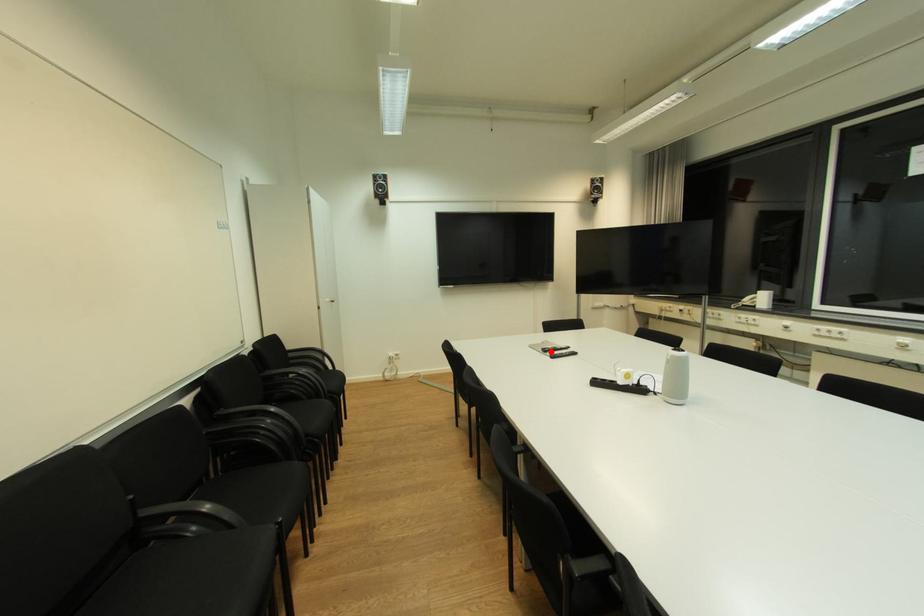
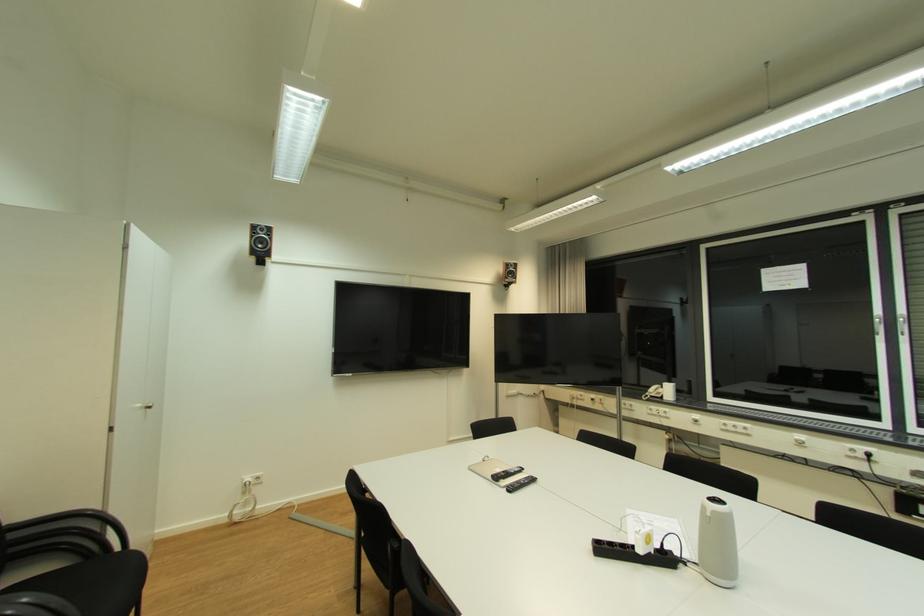
Find the pixel in the second image that matches the highlighted location in the first image.

(502, 479)